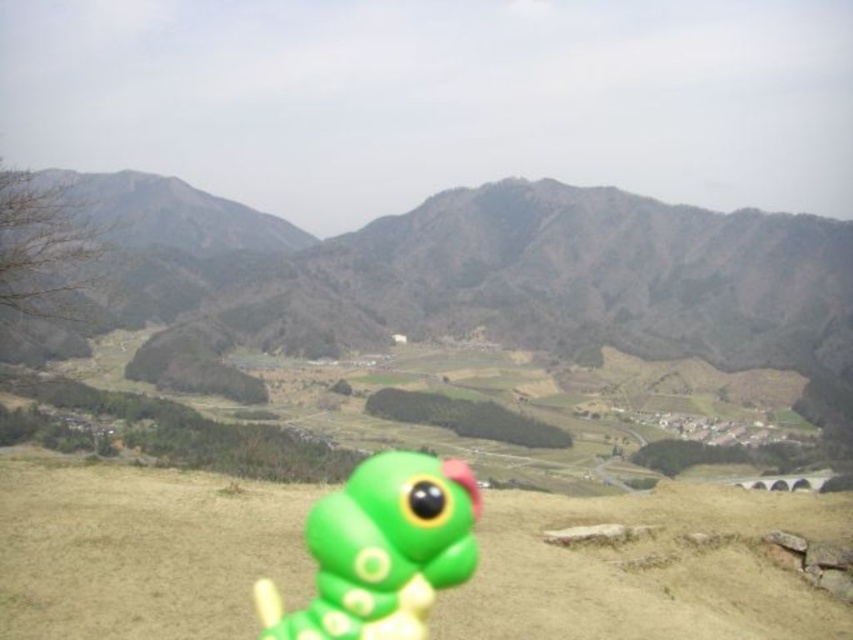
You are a child playing in the scenic landscape with mountains in the background. You have a green matte toy at center and a green matte toy at lower center. Which toy is located to the right of the other?

The green matte toy at center is positioned on the right side of the green matte toy at lower center.

You are standing at the lower portion of the image and want to reach the point marked as point (408,525). There is an obstacle at point (134,515). Will you encounter the obstacle before reaching your destination?

Point (134,515) is behind point (408,525), so you will not encounter the obstacle before reaching your destination.